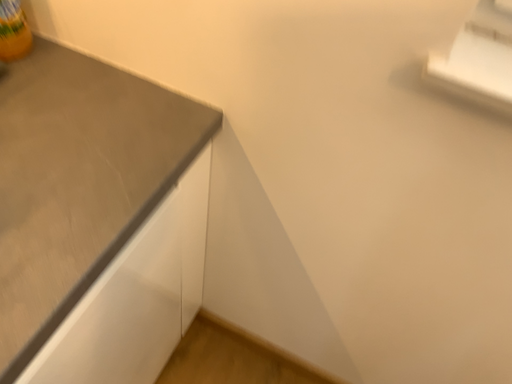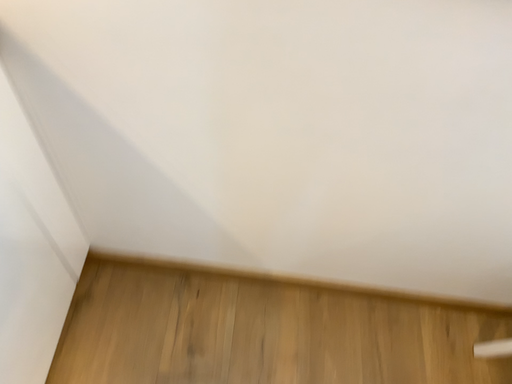
Question: Which way did the camera rotate in the video?

Choices:
 (A) rotated upward
 (B) rotated downward

Answer: (B)